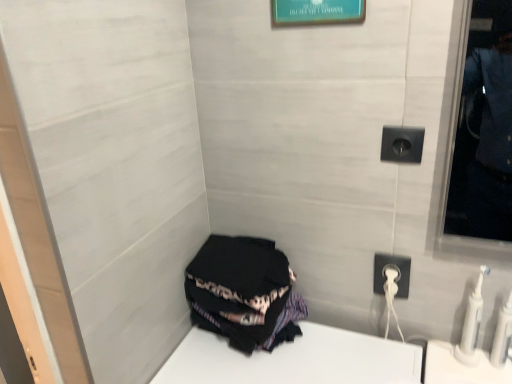
The height and width of the screenshot is (384, 512). What do you see at coordinates (502, 335) in the screenshot? I see `white plastic toothbrushes at lower right, acting as the 2th toiletry starting from the left` at bounding box center [502, 335].

Identify the location of white plastic toothbrush at lower right, acting as the second toiletry starting from the right. This screenshot has width=512, height=384. point(472,323).

What do you see at coordinates (472, 323) in the screenshot? I see `white plastic toothbrush at lower right, which is counted as the 1th toiletry, starting from the left` at bounding box center [472, 323].

The width and height of the screenshot is (512, 384). Describe the element at coordinates (394, 269) in the screenshot. I see `white plastic power outlet at lower right` at that location.

Locate an element on the screen. black fabric at lower left is located at coordinates (244, 293).

Can you tell me how much white plastic toothbrush at lower right, acting as the second toiletry starting from the right, and white plastic toothbrushes at lower right, acting as the 2th toiletry starting from the left, differ in facing direction?

The angular difference between white plastic toothbrush at lower right, acting as the second toiletry starting from the right, and white plastic toothbrushes at lower right, acting as the 2th toiletry starting from the left, is 0.00556 degrees.

Is white plastic toothbrush at lower right, acting as the second toiletry starting from the right, not within white plastic toothbrushes at lower right, acting as the 2th toiletry starting from the left?

Yes, white plastic toothbrush at lower right, acting as the second toiletry starting from the right, is outside of white plastic toothbrushes at lower right, acting as the 2th toiletry starting from the left.

Which point is more forward, (477,334) or (506,347)?

The point (506,347) is closer.

Between white plastic power outlet at lower right and black fabric at lower left, which one appears on the right side from the viewer's perspective?

From the viewer's perspective, white plastic power outlet at lower right appears more on the right side.

In terms of height, does white plastic power outlet at lower right look taller or shorter compared to black fabric at lower left?

In the image, white plastic power outlet at lower right appears to be shorter than black fabric at lower left.

How much distance is there between white plastic power outlet at lower right and black fabric at lower left?

They are 13.27 inches apart.

Can you confirm if black plastic outlet at upper right is thinner than white plastic toothbrush at lower right, which is counted as the 1th toiletry, starting from the left?

Correct, the width of black plastic outlet at upper right is less than that of white plastic toothbrush at lower right, which is counted as the 1th toiletry, starting from the left.

What's the angular difference between black plastic outlet at upper right and white plastic toothbrush at lower right, acting as the second toiletry starting from the right,'s facing directions?

black plastic outlet at upper right and white plastic toothbrush at lower right, acting as the second toiletry starting from the right, are facing 0.106 degrees away from each other.

From a real-world perspective, between black plastic outlet at upper right and white plastic toothbrush at lower right, acting as the second toiletry starting from the right, who is vertically lower?

From a 3D spatial view, white plastic toothbrush at lower right, acting as the second toiletry starting from the right, is below.

Is black plastic outlet at upper right positioned before white plastic toothbrush at lower right, which is counted as the 1th toiletry, starting from the left?

Yes, black plastic outlet at upper right is in front of white plastic toothbrush at lower right, which is counted as the 1th toiletry, starting from the left.

Considering the sizes of black fabric at lower left and white plastic toothbrush at lower right, which is counted as the 1th toiletry, starting from the left, in the image, is black fabric at lower left bigger or smaller than white plastic toothbrush at lower right, which is counted as the 1th toiletry, starting from the left,?

Considering their sizes, black fabric at lower left takes up more space than white plastic toothbrush at lower right, which is counted as the 1th toiletry, starting from the left.

Between black fabric at lower left and white plastic toothbrush at lower right, which is counted as the 1th toiletry, starting from the left, which one has less height?

black fabric at lower left is shorter.

From a real-world perspective, between black fabric at lower left and white plastic toothbrush at lower right, which is counted as the 1th toiletry, starting from the left, who is vertically lower?

From a 3D spatial view, black fabric at lower left is below.

Are black fabric at lower left and white plastic toothbrush at lower right, acting as the second toiletry starting from the right, beside each other?

No, black fabric at lower left is not beside white plastic toothbrush at lower right, acting as the second toiletry starting from the right.

Who is shorter, white plastic toothbrushes at lower right, acting as the 2th toiletry starting from the left, or black fabric at lower left?

black fabric at lower left is shorter.

In the image, there is a white plastic toothbrushes at lower right, which ranks as the 1th toiletry in right-to-left order. Identify the location of clothing above it (from the image's perspective). The height and width of the screenshot is (384, 512). (244, 293).

From a real-world perspective, between white plastic toothbrushes at lower right, which ranks as the 1th toiletry in right-to-left order, and black fabric at lower left, who is vertically higher?

In real-world perspective, black fabric at lower left is above.

Which object is thinner, white plastic toothbrushes at lower right, acting as the 2th toiletry starting from the left, or black fabric at lower left?

white plastic toothbrushes at lower right, acting as the 2th toiletry starting from the left.

Is teal glossy picture frame at upper center facing away from white plastic toothbrush at lower right, which is counted as the 1th toiletry, starting from the left?

No.

Is teal glossy picture frame at upper center positioned far away from white plastic toothbrush at lower right, which is counted as the 1th toiletry, starting from the left?

No.

From a real-world perspective, is teal glossy picture frame at upper center under white plastic toothbrush at lower right, which is counted as the 1th toiletry, starting from the left?

Actually, teal glossy picture frame at upper center is physically above white plastic toothbrush at lower right, which is counted as the 1th toiletry, starting from the left, in the real world.

Does teal glossy picture frame at upper center lie behind white plastic toothbrush at lower right, acting as the second toiletry starting from the right?

No, the depth of teal glossy picture frame at upper center is less than that of white plastic toothbrush at lower right, acting as the second toiletry starting from the right.

Are white plastic toothbrushes at lower right, acting as the 2th toiletry starting from the left, and white plastic power outlet at lower right making contact?

No, white plastic toothbrushes at lower right, acting as the 2th toiletry starting from the left, is not in contact with white plastic power outlet at lower right.

From the image's perspective, which one is positioned higher, white plastic toothbrushes at lower right, which ranks as the 1th toiletry in right-to-left order, or white plastic power outlet at lower right?

white plastic power outlet at lower right, from the image's perspective.

Consider the image. How different are the orientations of white plastic toothbrushes at lower right, acting as the 2th toiletry starting from the left, and white plastic power outlet at lower right in degrees?

The angle between the facing direction of white plastic toothbrushes at lower right, acting as the 2th toiletry starting from the left, and the facing direction of white plastic power outlet at lower right is 0.477 degrees.

Identify the location of toiletry located behind the white plastic toothbrushes at lower right, acting as the 2th toiletry starting from the left. (472, 323).

What are the coordinates of `clothing that appears in front of the white plastic power outlet at lower right` in the screenshot? It's located at (244, 293).

Considering their positions, is white plastic toothbrushes at lower right, which ranks as the 1th toiletry in right-to-left order, positioned further to black plastic outlet at upper right than white plastic power outlet at lower right?

white plastic toothbrushes at lower right, which ranks as the 1th toiletry in right-to-left order.

Which object lies nearer to the anchor point white plastic power outlet at lower right, black plastic outlet at upper right or white plastic toothbrush at lower right, acting as the second toiletry starting from the right?

Among the two, white plastic toothbrush at lower right, acting as the second toiletry starting from the right, is located nearer to white plastic power outlet at lower right.

Considering their positions, is teal glossy picture frame at upper center positioned further to white plastic toothbrushes at lower right, acting as the 2th toiletry starting from the left, than white plastic power outlet at lower right?

Based on the image, teal glossy picture frame at upper center appears to be further to white plastic toothbrushes at lower right, acting as the 2th toiletry starting from the left.

In the scene shown: When comparing their distances from white plastic toothbrushes at lower right, which ranks as the 1th toiletry in right-to-left order, does black fabric at lower left or white plastic toothbrush at lower right, acting as the second toiletry starting from the right, seem further?

The object further to white plastic toothbrushes at lower right, which ranks as the 1th toiletry in right-to-left order, is black fabric at lower left.

Considering their positions, is white plastic power outlet at lower right positioned closer to white plastic toothbrush at lower right, acting as the second toiletry starting from the right, than teal glossy picture frame at upper center?

The object closer to white plastic toothbrush at lower right, acting as the second toiletry starting from the right, is white plastic power outlet at lower right.

In the scene shown: When comparing their distances from black fabric at lower left, does teal glossy picture frame at upper center or white plastic power outlet at lower right seem closer?

white plastic power outlet at lower right.

Which object lies further to the anchor point white plastic power outlet at lower right, white plastic toothbrush at lower right, which is counted as the 1th toiletry, starting from the left, or black fabric at lower left?

The object further to white plastic power outlet at lower right is black fabric at lower left.

From the image, which object appears to be farther from white plastic toothbrushes at lower right, which ranks as the 1th toiletry in right-to-left order, white plastic power outlet at lower right or white plastic toothbrush at lower right, acting as the second toiletry starting from the right?

Among the two, white plastic power outlet at lower right is located further to white plastic toothbrushes at lower right, which ranks as the 1th toiletry in right-to-left order.

Image resolution: width=512 pixels, height=384 pixels. Find the location of `electric outlet between teal glossy picture frame at upper center and white plastic power outlet at lower right vertically`. electric outlet between teal glossy picture frame at upper center and white plastic power outlet at lower right vertically is located at coordinates (402, 144).

At what (x,y) coordinates should I click in order to perform the action: click on power outlet between teal glossy picture frame at upper center and white plastic toothbrushes at lower right, acting as the 2th toiletry starting from the left, in the up-down direction. Please return your answer as a coordinate pair (x, y). Image resolution: width=512 pixels, height=384 pixels. Looking at the image, I should click on (394, 269).

At what (x,y) coordinates should I click in order to perform the action: click on power outlet located between black fabric at lower left and white plastic toothbrushes at lower right, which ranks as the 1th toiletry in right-to-left order, in the left-right direction. Please return your answer as a coordinate pair (x, y). The height and width of the screenshot is (384, 512). Looking at the image, I should click on (394, 269).

At what (x,y) coordinates should I click in order to perform the action: click on electric outlet between teal glossy picture frame at upper center and white plastic toothbrushes at lower right, acting as the 2th toiletry starting from the left, in the vertical direction. Please return your answer as a coordinate pair (x, y). Looking at the image, I should click on (402, 144).